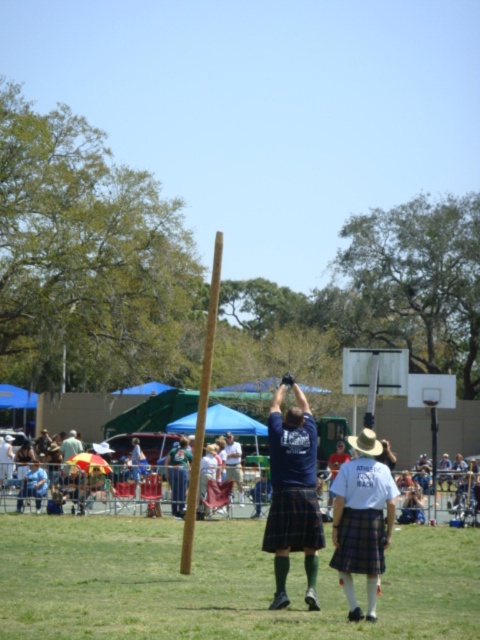
Question: Is plaid kilt at center positioned behind red plaid kilt at center?

Choices:
 (A) no
 (B) yes

Answer: (B)

Question: Among these objects, which one is nearest to the camera?

Choices:
 (A) plaid fabric kilt at center
 (B) red plaid kilt at center

Answer: (A)

Question: Can you confirm if plaid kilt at center is positioned below plaid fabric kilt at center?

Choices:
 (A) yes
 (B) no

Answer: (B)

Question: Which object is the farthest from the black plaid kilt at center?

Choices:
 (A) plaid kilt at center
 (B) red plaid kilt at center
 (C) plaid fabric kilt at center

Answer: (B)

Question: Can you confirm if black plaid kilt at center is positioned below red plaid kilt at center?

Choices:
 (A) yes
 (B) no

Answer: (B)

Question: Considering the real-world distances, which object is closest to the plaid kilt at center?

Choices:
 (A) black plaid kilt at center
 (B) plaid fabric kilt at center
 (C) red plaid kilt at center

Answer: (A)